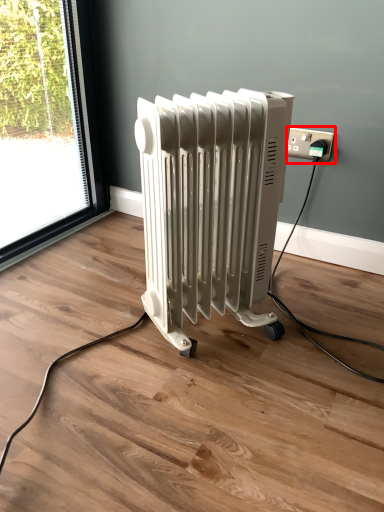
Question: Considering the relative positions of power plugs and sockets (annotated by the red box) and radiator in the image provided, where is power plugs and sockets (annotated by the red box) located with respect to the staircase?

Choices:
 (A) left
 (B) right

Answer: (B)